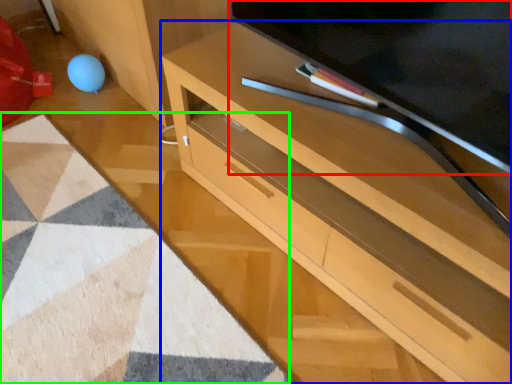
Question: Based on their relative distances, which object is nearer to television (highlighted by a red box)? Choose from desk (highlighted by a blue box) and mat (highlighted by a green box).

Choices:
 (A) desk
 (B) mat

Answer: (A)